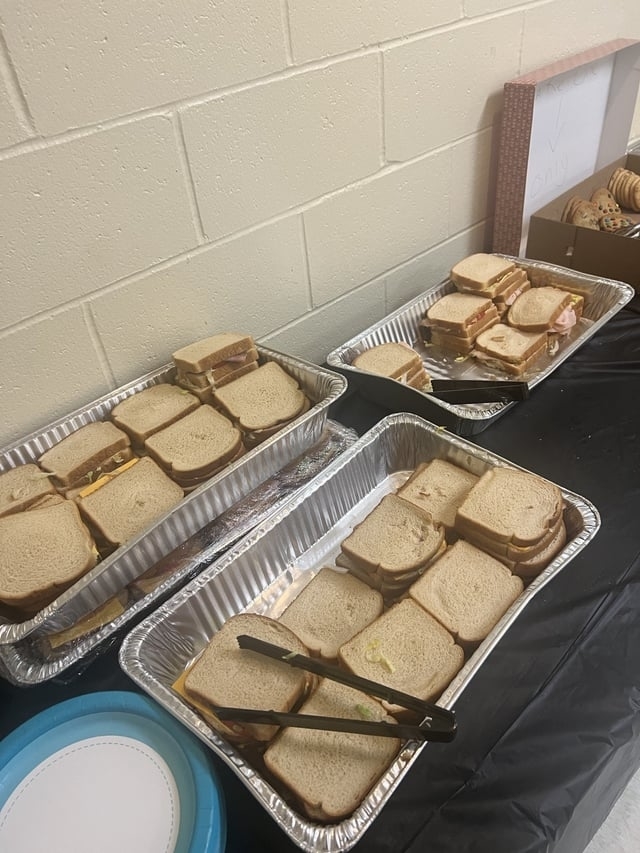
The image size is (640, 853). In order to click on plate in this screenshot , I will do `click(138, 745)`.